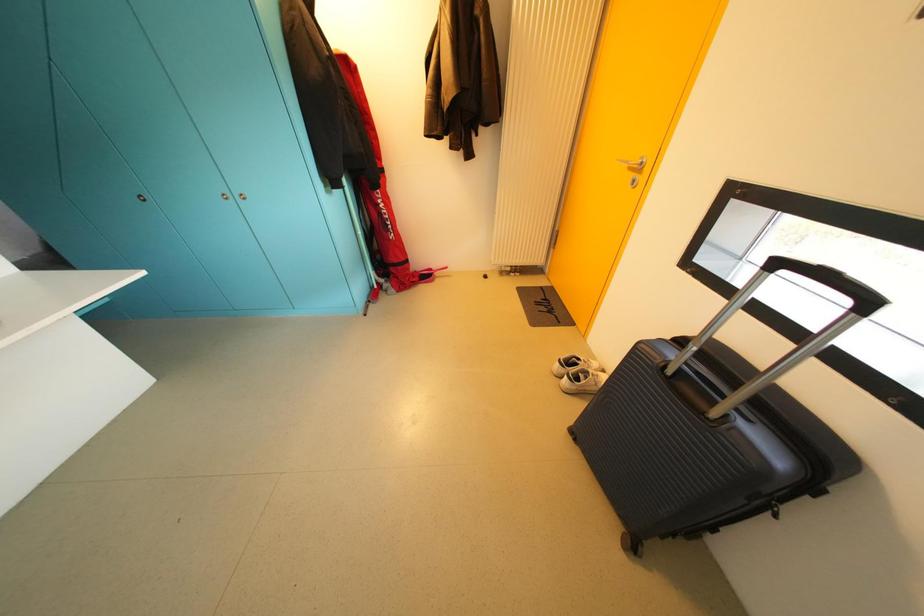
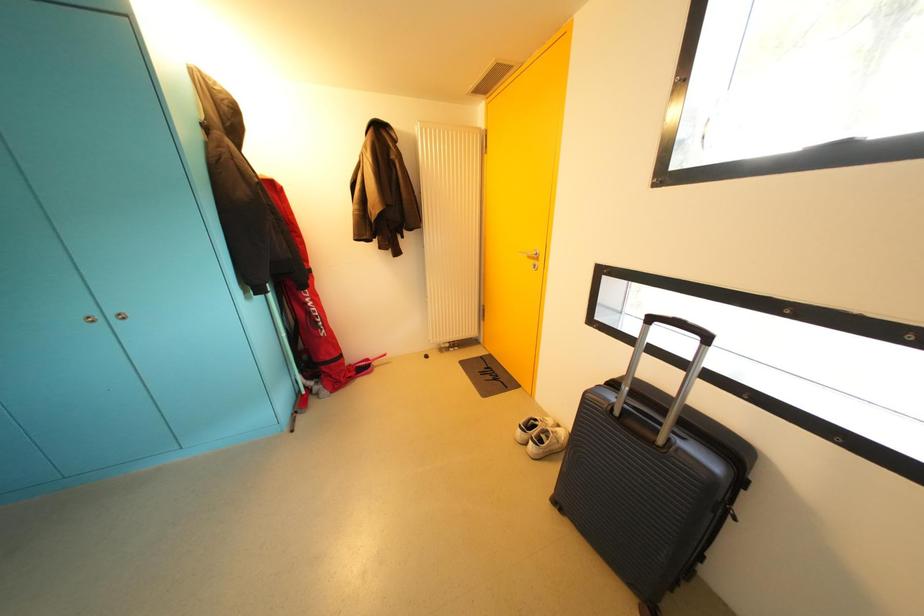
What movement of the cameraman would produce the second image?

The cameraman moved toward left, backward.